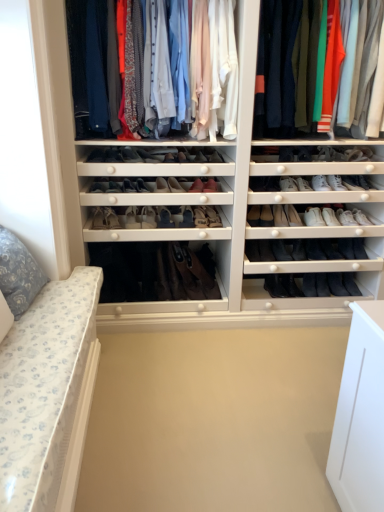
Question: Would you say leather boot at center, the twelfth shoe viewed from the left, is to the left or to the right of matte black shoe at center, which is the eighth shoe from left to right, in the picture?

Choices:
 (A) left
 (B) right

Answer: (B)

Question: Is leather boot at center, the twelfth shoe viewed from the left, in front of or behind matte black shoe at center, which is the eighth shoe from left to right, in the image?

Choices:
 (A) behind
 (B) front

Answer: (A)

Question: Based on their relative distances, which object is farther from the matte fabric shirts at upper center, positioned as the 2th clothing in right-to-left order?

Choices:
 (A) brown suede boot at center
 (B) leather boot at center, the 14th shoe viewed from the right
 (C) leather boot at center, which is the ninth shoe in left-to-right order
 (D) black leather boot at lower center, the fourth shoe when ordered from right to left
 (E) leather boot at center, the twelfth shoe from the right

Answer: (D)

Question: Estimate the real-world distances between objects in this image. Which object is farther from the brown suede boot at center?

Choices:
 (A) white leather shoe at center right, which is the 1th shoe in right-to-left order
 (B) leather boot at center, the fourteenth shoe when ordered from left to right
 (C) floral fabric pillow at left
 (D) black leather boot at lower center, acting as the 21th shoe starting from the left
 (E) leather boot at center, which is counted as the 17th shoe, starting from the left

Answer: (A)